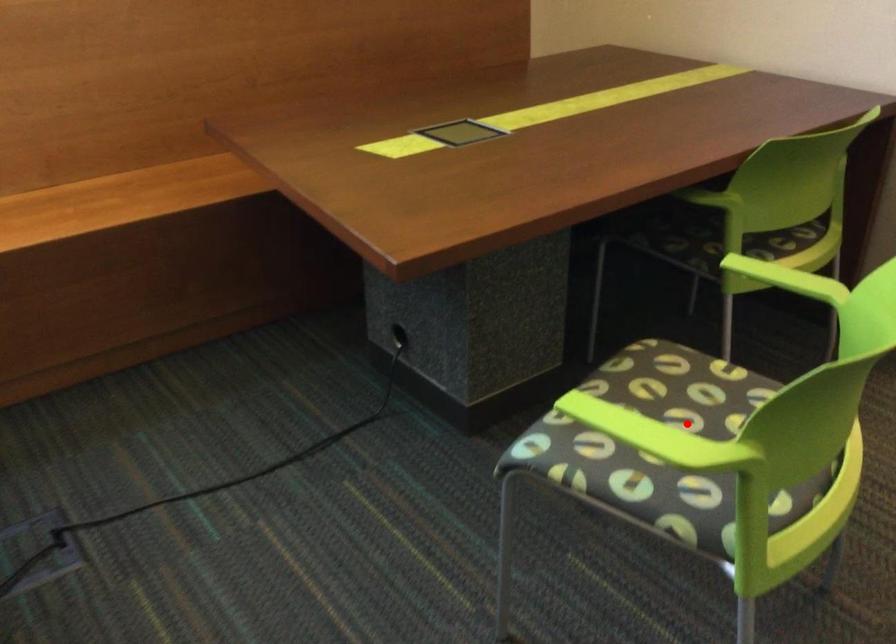
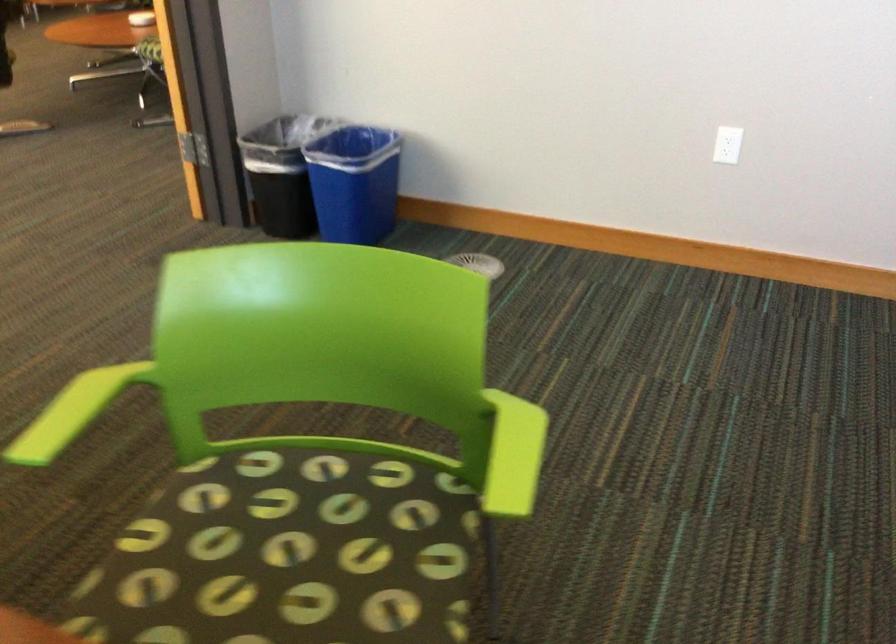
In the second image, find the point that corresponds to the highlighted location in the first image.

(297, 545)